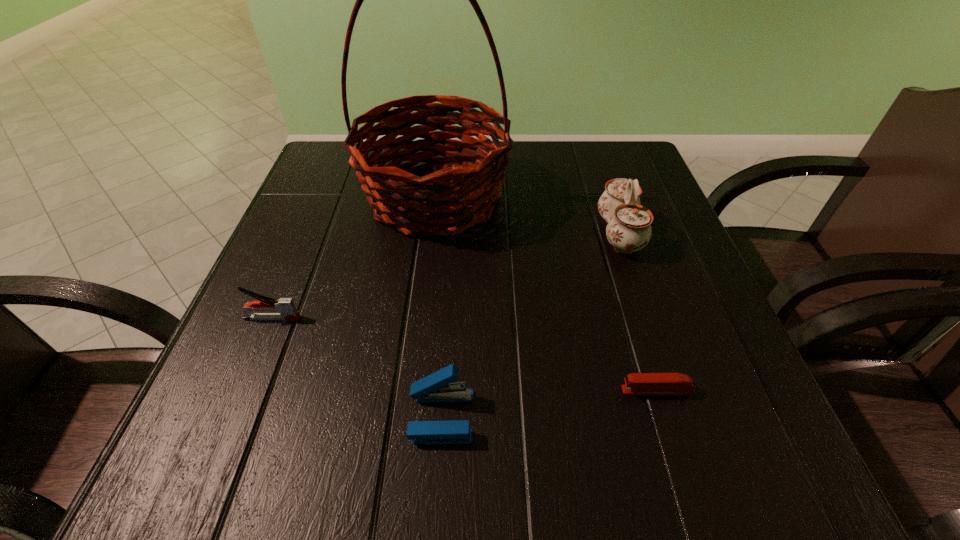
Find the location of a particular element. This screenshot has height=540, width=960. empty space that is in between the tallest object and the leftmost stapler is located at coordinates (353, 258).

Where is `object that stands as the third closest to the farthest stapler`? The width and height of the screenshot is (960, 540). object that stands as the third closest to the farthest stapler is located at coordinates (635, 383).

Locate an element on the screen. This screenshot has width=960, height=540. object that can be found as the third closest to the leftmost object is located at coordinates (635, 383).

Image resolution: width=960 pixels, height=540 pixels. Find the location of `stapler that is the second closest to the third nearest object`. stapler that is the second closest to the third nearest object is located at coordinates (635, 383).

Choose which stapler is the nearest neighbor to the leftmost stapler. Please provide its 2D coordinates. Your answer should be formatted as a tuple, i.e. [(x, y)], where the tuple contains the x and y coordinates of a point satisfying the conditions above.

[(437, 387)]

Locate an element on the screen. This screenshot has width=960, height=540. vacant space that satisfies the following two spatial constraints: 1. on the front side of the tallest object; 2. on the handle side of the farthest stapler is located at coordinates tap(420, 318).